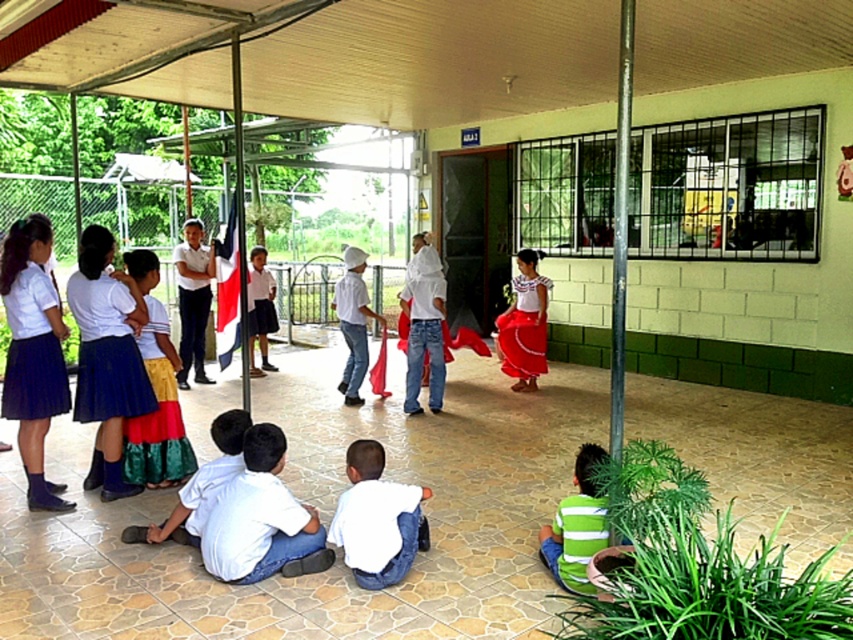
You are standing in the school courtyard and want to take a photo of both the point at coordinates point (349, 388) and point (251, 326). Which point should you focus on first to ensure both are in focus?

You should focus on point (349, 388) first because it is closer to the camera than point (251, 326), ensuring both points are within the depth of field.

You are a photographer trying to capture the entire group of children in the image. You notice the blue pleated skirt at left and the white matte shirt at center. Which object should you focus on to ensure the entire group is in frame?

The blue pleated skirt at left occupies less space than the white matte shirt at center, so focusing on the white matte shirt at center would help ensure the entire group is captured in the frame since it takes up more space and likely represents a central point of interest.